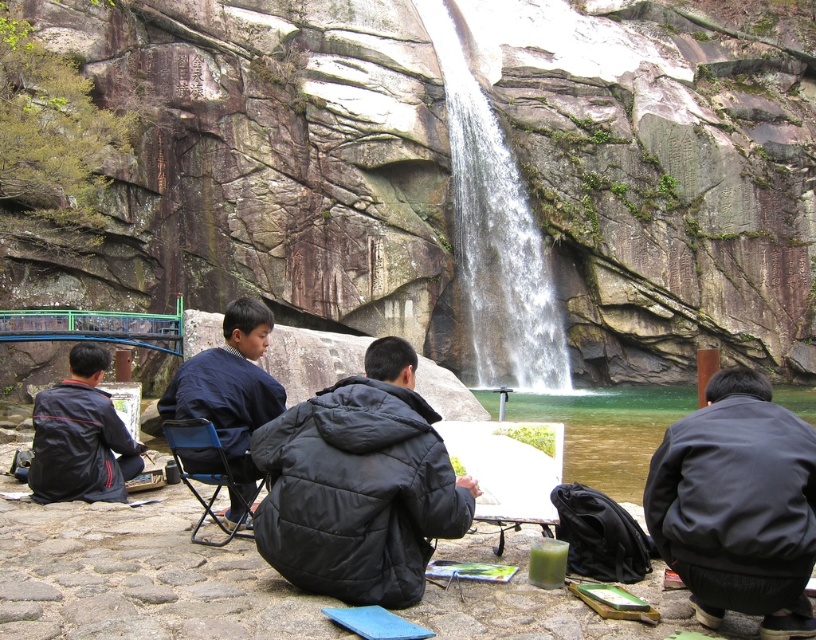
You are a hiker carrying a backpack that has a width of 30 cm. You need to pass between the white textured water at center and the dark blue fabric jacket at center. Can your backpack fit through the space between them?

The white textured water at center is bigger than the dark blue fabric jacket at center, so the space between them is sufficient for a backpack of 30 cm width to pass through.

You are a photographer trying to capture a group photo of the four individuals seated on the cobblestone surface. The white textured water at center and the dark blue fabric jacket at center are both in the background. Since you want to ensure both elements are visible, which one should you adjust your camera focus to prioritize based on their sizes?

The white textured water at center is wider than the dark blue fabric jacket at center, so you should prioritize focusing on the white textured water at center to ensure its broader area is captured clearly.